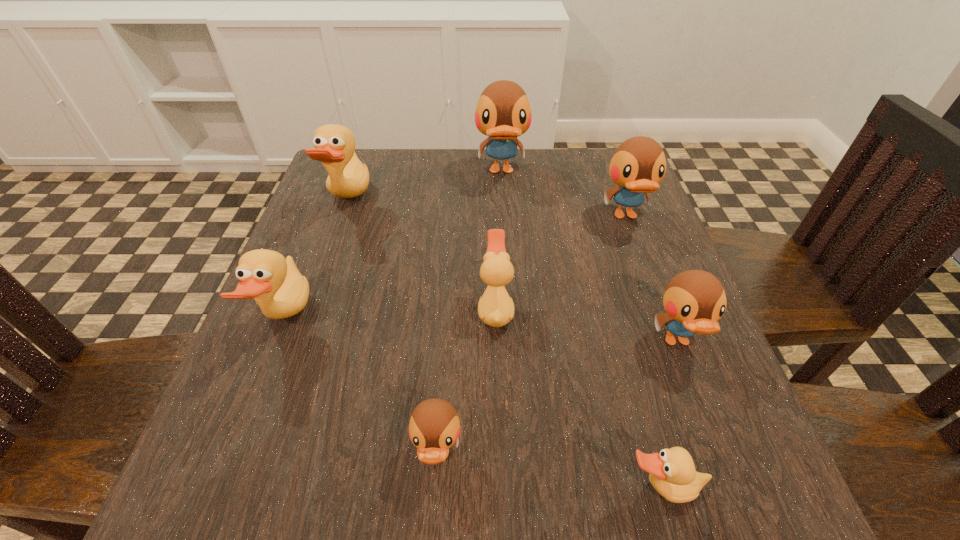
This screenshot has width=960, height=540. I want to click on the second blue duck from left to right, so click(x=503, y=112).

What are the coordinates of `the farthest blue duck` in the screenshot? It's located at (503, 112).

Where is `the biggest tan duck`? the biggest tan duck is located at coordinates (334, 145).

Identify the location of the third nearest blue duck. (638, 165).

Where is `the third smallest tan duck`? This screenshot has height=540, width=960. the third smallest tan duck is located at coordinates (275, 283).

Image resolution: width=960 pixels, height=540 pixels. In order to click on the third farthest blue duck in this screenshot , I will do `click(694, 300)`.

Find the location of a particular element. The width and height of the screenshot is (960, 540). the second smallest tan duck is located at coordinates (495, 308).

You are a GUI agent. You are given a task and a screenshot of the screen. Output one action in this format:
    pyautogui.click(x=<x>, y=<y>)
    Task: Click on the nearest blue duck
    This screenshot has width=960, height=540.
    Given the screenshot: What is the action you would take?
    pyautogui.click(x=434, y=427)

Identify the location of the leftmost blue duck. (434, 427).

You are a GUI agent. You are given a task and a screenshot of the screen. Output one action in this format:
    pyautogui.click(x=<x>, y=<y>)
    Task: Click on the smallest tan duck
    The image size is (960, 540).
    Given the screenshot: What is the action you would take?
    pyautogui.click(x=672, y=472)